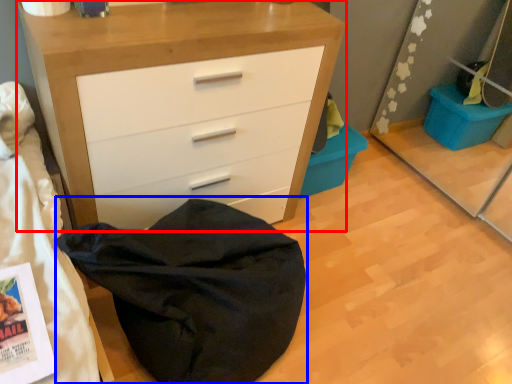
Question: Which object is further to the camera taking this photo, chest of drawers (highlighted by a red box) or bean bag chair (highlighted by a blue box)?

Choices:
 (A) chest of drawers
 (B) bean bag chair

Answer: (A)